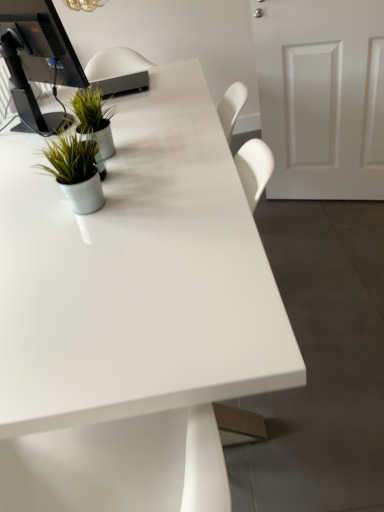
Question: Can you confirm if green matte plant at upper left, which is the 1th houseplant in back-to-front order, is positioned to the right of metallic silver pot at left, marked as the first houseplant in a front-to-back arrangement?

Choices:
 (A) no
 (B) yes

Answer: (A)

Question: From the image's perspective, is green matte plant at upper left, arranged as the 1th houseplant when viewed from the top, beneath metallic silver pot at left, positioned as the 2th houseplant in back-to-front order?

Choices:
 (A) no
 (B) yes

Answer: (A)

Question: Is green matte plant at upper left, marked as the second houseplant in a front-to-back arrangement, oriented away from metallic silver pot at left, positioned as the 2th houseplant in back-to-front order?

Choices:
 (A) yes
 (B) no

Answer: (B)

Question: Considering the relative sizes of green matte plant at upper left, marked as the second houseplant in a front-to-back arrangement, and metallic silver pot at left, positioned as the 2th houseplant in back-to-front order, in the image provided, is green matte plant at upper left, marked as the second houseplant in a front-to-back arrangement, bigger than metallic silver pot at left, positioned as the 2th houseplant in back-to-front order,?

Choices:
 (A) yes
 (B) no

Answer: (A)

Question: Can you confirm if green matte plant at upper left, marked as the second houseplant in a front-to-back arrangement, is thinner than metallic silver pot at left, marked as the first houseplant in a front-to-back arrangement?

Choices:
 (A) no
 (B) yes

Answer: (A)

Question: From a real-world perspective, is white matte door at right above or below metallic silver pot at left, the 2th houseplant in the top-to-bottom sequence?

Choices:
 (A) below
 (B) above

Answer: (A)

Question: In terms of width, does white matte door at right look wider or thinner when compared to metallic silver pot at left, positioned as the 2th houseplant in back-to-front order?

Choices:
 (A) thin
 (B) wide

Answer: (A)

Question: In terms of size, does white matte door at right appear bigger or smaller than metallic silver pot at left, which is counted as the first houseplant, starting from the bottom?

Choices:
 (A) small
 (B) big

Answer: (B)

Question: Is point (334, 186) positioned closer to the camera than point (77, 197)?

Choices:
 (A) closer
 (B) farther

Answer: (B)

Question: Do you think green matte plant at upper left, marked as the second houseplant in a front-to-back arrangement, is within black glossy monitor at upper left, or outside of it?

Choices:
 (A) inside
 (B) outside

Answer: (B)

Question: Is green matte plant at upper left, which is the 1th houseplant in back-to-front order, to the left or to the right of black glossy monitor at upper left in the image?

Choices:
 (A) right
 (B) left

Answer: (A)

Question: In terms of size, does green matte plant at upper left, marked as the second houseplant in a front-to-back arrangement, appear bigger or smaller than black glossy monitor at upper left?

Choices:
 (A) big
 (B) small

Answer: (B)

Question: From a real-world perspective, is green matte plant at upper left, arranged as the 1th houseplant when viewed from the top, above or below black glossy monitor at upper left?

Choices:
 (A) below
 (B) above

Answer: (A)

Question: Is white glossy desk at center to the left or to the right of green matte plant at upper left, marked as the second houseplant in a front-to-back arrangement, in the image?

Choices:
 (A) right
 (B) left

Answer: (A)

Question: From a real-world perspective, relative to green matte plant at upper left, arranged as the 1th houseplant when viewed from the top, is white glossy desk at center vertically above or below?

Choices:
 (A) below
 (B) above

Answer: (A)